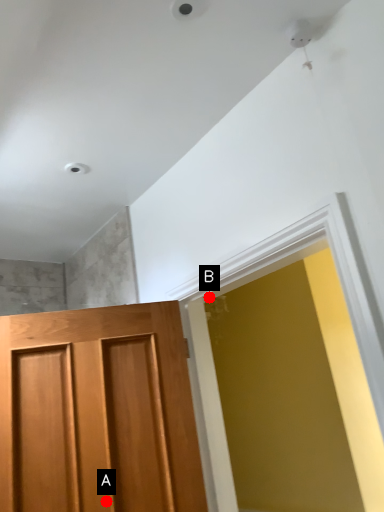
Question: Two points are circled on the image, labeled by A and B beside each circle. Which point is farther from the camera taking this photo?

Choices:
 (A) A is further
 (B) B is further

Answer: (B)